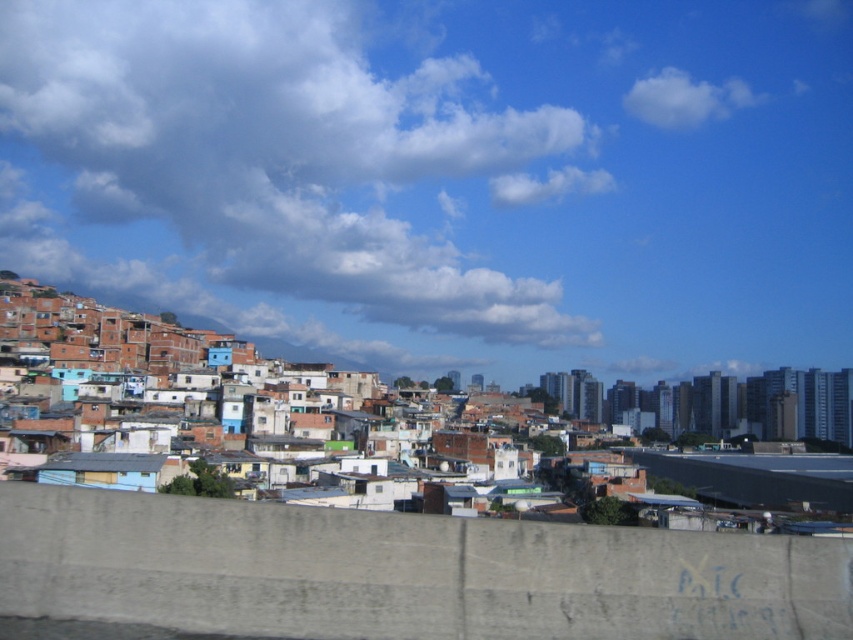
Question: Can you confirm if cloudy sky at upper center is positioned above white fluffy cloud at upper right?

Choices:
 (A) no
 (B) yes

Answer: (A)

Question: Among these objects, which one is farthest from the camera?

Choices:
 (A) cloudy sky at upper center
 (B) white fluffy cloud at upper right

Answer: (B)

Question: Is cloudy sky at upper center positioned before white fluffy cloud at upper right?

Choices:
 (A) yes
 (B) no

Answer: (A)

Question: Which point is farther from the camera taking this photo?

Choices:
 (A) (733, 104)
 (B) (486, 74)

Answer: (A)

Question: Is cloudy sky at upper center above white fluffy cloud at upper right?

Choices:
 (A) yes
 (B) no

Answer: (B)